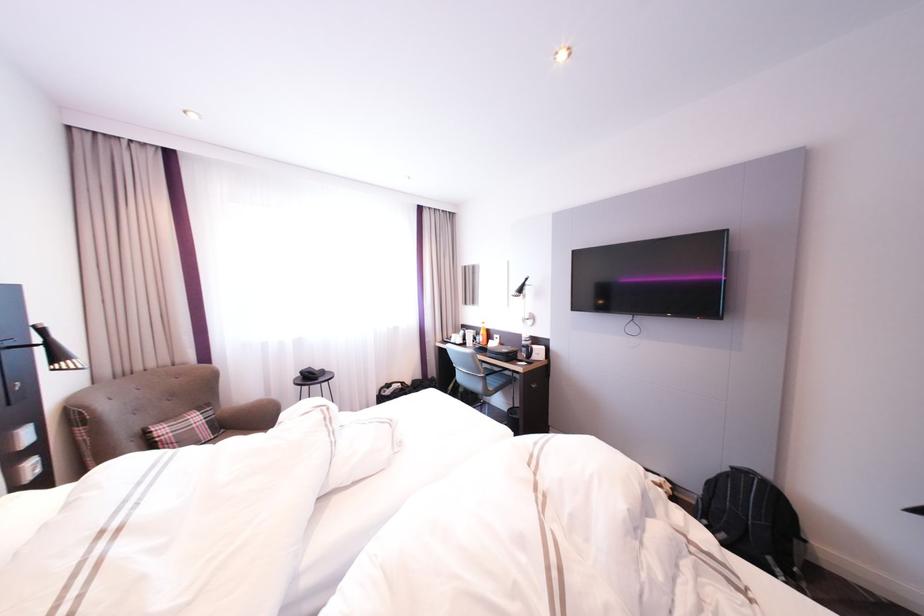
This screenshot has width=924, height=616. I want to click on black electric kettle, so click(x=392, y=391).